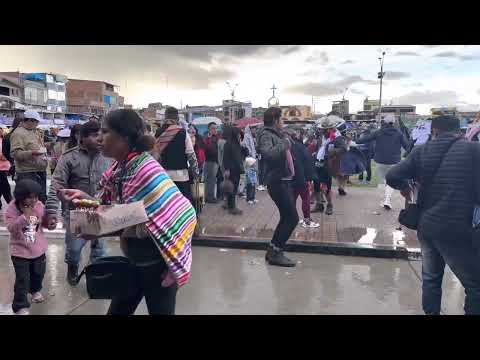
In order to click on windows in this screenshot , I will do `click(51, 96)`, `click(58, 97)`, `click(29, 96)`, `click(33, 96)`, `click(49, 107)`, `click(60, 109)`.